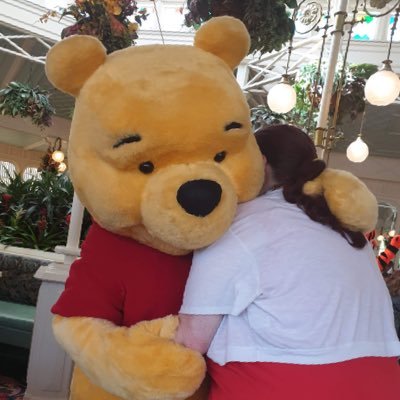
Identify the location of round light. (385, 90).